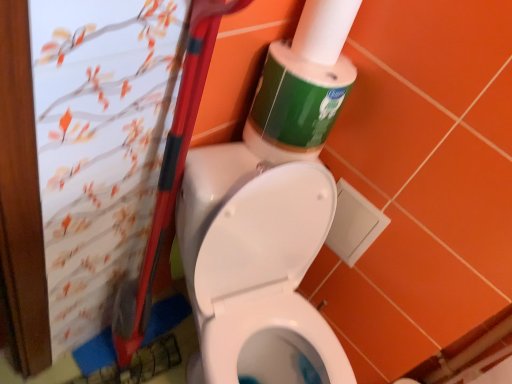
Question: Does green matte toilet paper at upper right have a greater height compared to green matte toilet paper at upper center?

Choices:
 (A) no
 (B) yes

Answer: (B)

Question: Can you confirm if green matte toilet paper at upper right is positioned to the right of green matte toilet paper at upper center?

Choices:
 (A) yes
 (B) no

Answer: (A)

Question: From the image's perspective, is green matte toilet paper at upper right on green matte toilet paper at upper center?

Choices:
 (A) no
 (B) yes

Answer: (B)

Question: Is green matte toilet paper at upper right located outside green matte toilet paper at upper center?

Choices:
 (A) yes
 (B) no

Answer: (A)

Question: Is green matte toilet paper at upper right thinner than green matte toilet paper at upper center?

Choices:
 (A) no
 (B) yes

Answer: (B)

Question: Is green matte toilet paper at upper right behind green matte toilet paper at upper center?

Choices:
 (A) yes
 (B) no

Answer: (B)

Question: From the image's perspective, is green matte toilet paper at upper center beneath green matte toilet paper at upper right?

Choices:
 (A) no
 (B) yes

Answer: (B)

Question: Is green matte toilet paper at upper center oriented towards green matte toilet paper at upper right?

Choices:
 (A) yes
 (B) no

Answer: (B)

Question: Does green matte toilet paper at upper center have a lesser width compared to green matte toilet paper at upper right?

Choices:
 (A) yes
 (B) no

Answer: (B)

Question: Can you confirm if green matte toilet paper at upper center is shorter than green matte toilet paper at upper right?

Choices:
 (A) yes
 (B) no

Answer: (A)

Question: Is green matte toilet paper at upper right at the back of green matte toilet paper at upper center?

Choices:
 (A) yes
 (B) no

Answer: (B)

Question: Is green matte toilet paper at upper center not within green matte toilet paper at upper right?

Choices:
 (A) yes
 (B) no

Answer: (A)

Question: Looking at their shapes, would you say green matte toilet paper at upper right is wider or thinner than green matte toilet paper at upper center?

Choices:
 (A) wide
 (B) thin

Answer: (B)